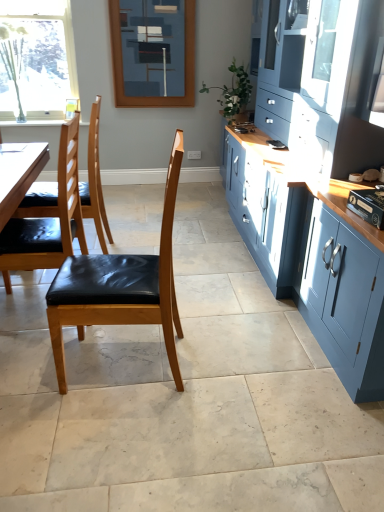
Find the location of a particular element. This screenshot has height=512, width=384. vacant region under matte wood chair at left, which is the third chair from back to front (from a real-world perspective) is located at coordinates (121, 361).